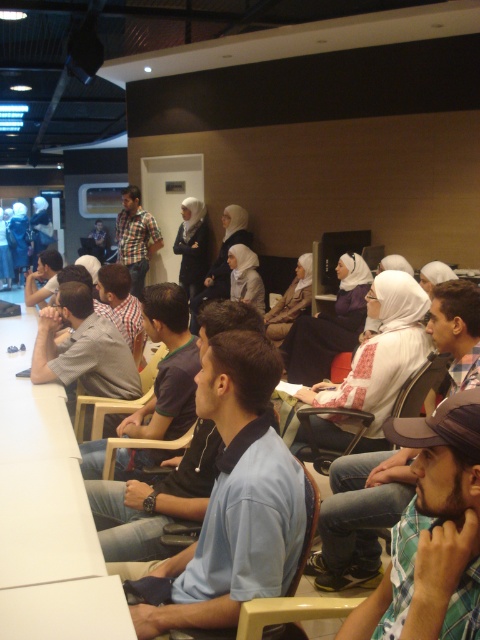
You are standing at the entrance of the room and need to locate the person wearing the plaid shirt at center. Based on the coordinates provided, in which direction should you look to find them?

The plaid shirt at center is located at coordinates point (135, 237), so you should look towards the center of the room to find them.

You are organizing a seating arrangement for an event and need to ensure that the plaid shirt at center and the light brown plastic chair at center can fit side by side without overlapping. Based on their sizes, do you think they can be placed next to each other without overlapping?

The plaid shirt at center might be wider than the light brown plastic chair at center, so there is a possibility that they cannot be placed next to each other without overlapping if the total width exceeds the available space.